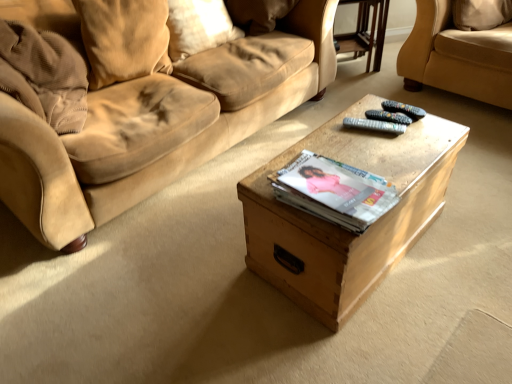
You are a GUI agent. You are given a task and a screenshot of the screen. Output one action in this format:
    pyautogui.click(x=<x>, y=<y>)
    Task: Click on the free space to the left of black plastic remote at center, arranged as the second remote when viewed from the top
    The height and width of the screenshot is (384, 512).
    Given the screenshot: What is the action you would take?
    pyautogui.click(x=338, y=133)